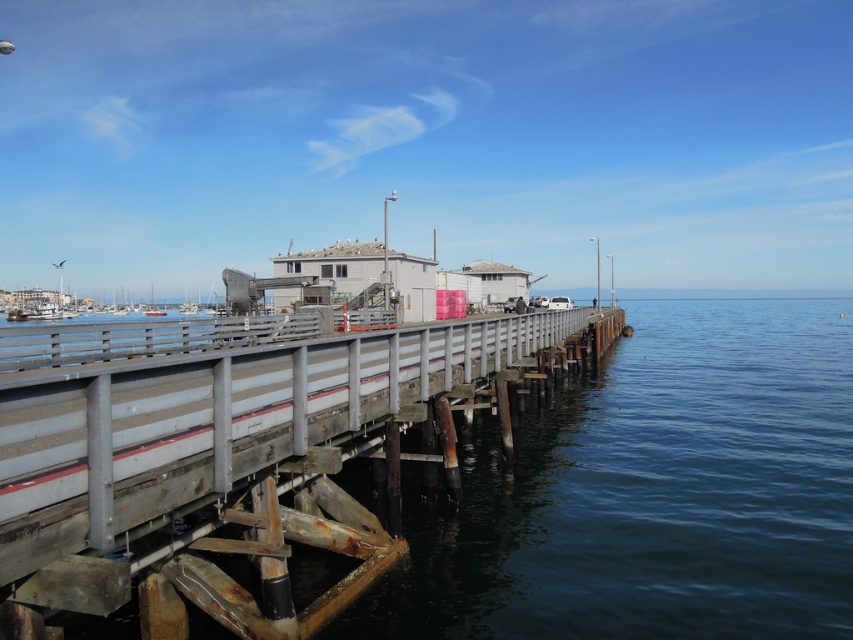
Does dark blue water at center have a smaller size compared to rusty metal rail at center?

No.

Does point (809, 301) come behind point (401, 348)?

Yes.

The height and width of the screenshot is (640, 853). What are the coordinates of `dark blue water at center` in the screenshot? It's located at (651, 492).